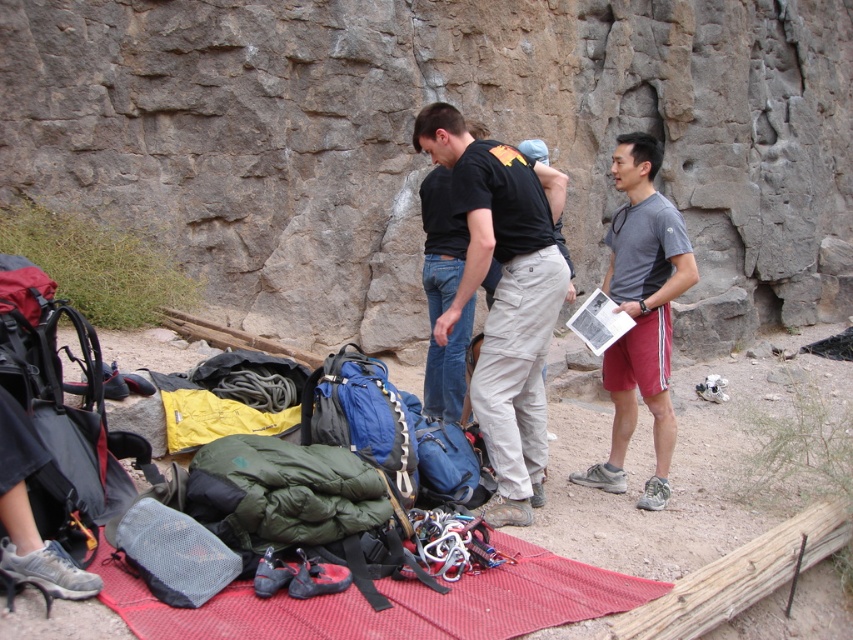
Who is positioned more to the left, black cotton t-shirt at center or red rubber mat at lower center?

red rubber mat at lower center

Can you confirm if black cotton t-shirt at center is smaller than red rubber mat at lower center?

No, black cotton t-shirt at center is not smaller than red rubber mat at lower center.

Is point (490, 340) farther from viewer compared to point (494, 577)?

That is True.

You are a GUI agent. You are given a task and a screenshot of the screen. Output one action in this format:
    pyautogui.click(x=<x>, y=<y>)
    Task: Click on the black cotton t-shirt at center
    This screenshot has width=853, height=640.
    Given the screenshot: What is the action you would take?
    pyautogui.click(x=502, y=300)

Where is `gray rough rock face at center`? The image size is (853, 640). gray rough rock face at center is located at coordinates (426, 160).

Is gray rough rock face at center positioned at the back of red rubber mat at lower center?

Yes, it is.

This screenshot has width=853, height=640. What do you see at coordinates (426, 160) in the screenshot?
I see `gray rough rock face at center` at bounding box center [426, 160].

Locate an element on the screen. The image size is (853, 640). gray rough rock face at center is located at coordinates pyautogui.click(x=426, y=160).

Is red rubber mat at lower center to the right of gray cotton t-shirt at center from the viewer's perspective?

Incorrect, red rubber mat at lower center is not on the right side of gray cotton t-shirt at center.

Does red rubber mat at lower center have a smaller size compared to gray cotton t-shirt at center?

Yes, red rubber mat at lower center is smaller than gray cotton t-shirt at center.

Between point (335, 637) and point (650, 300), which one is positioned in front?

Point (335, 637) is in front.

Identify the location of red rubber mat at lower center. This screenshot has width=853, height=640. (393, 602).